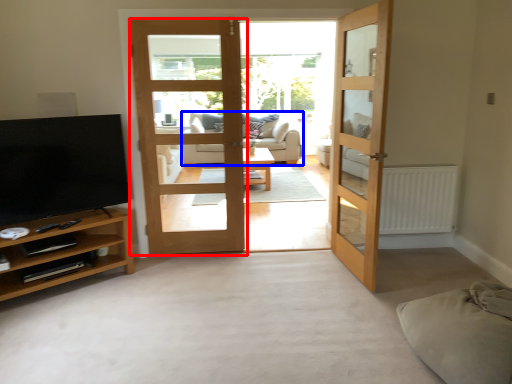
Question: Which object appears closest to the camera in this image, door (highlighted by a red box) or studio couch (highlighted by a blue box)?

Choices:
 (A) door
 (B) studio couch

Answer: (A)